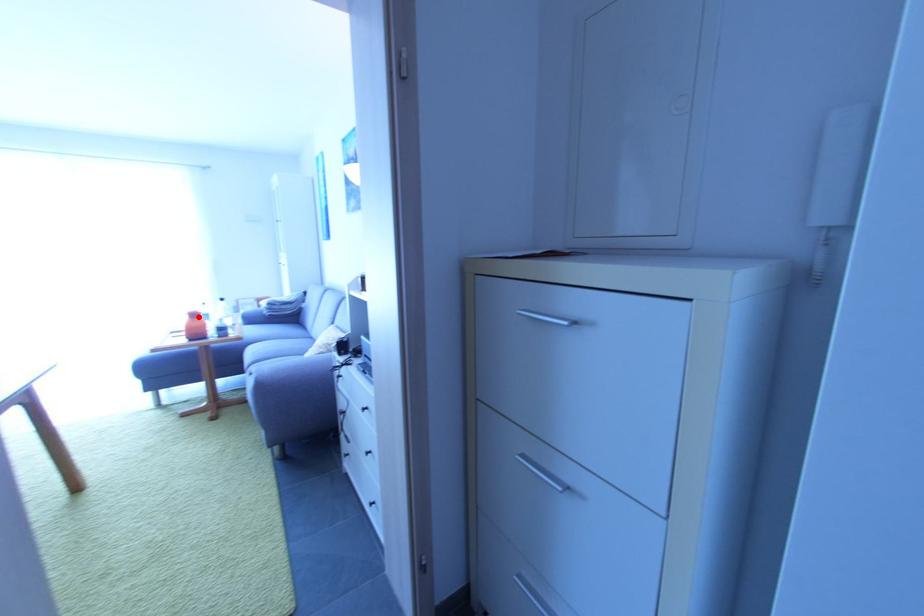
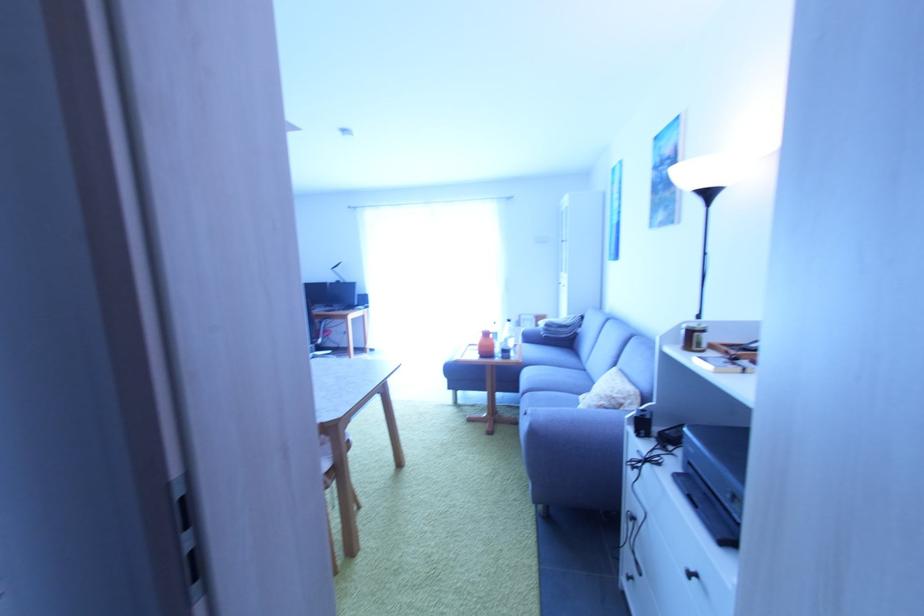
Where in the second image is the point corresponding to the highlighted location from the first image?

(492, 336)